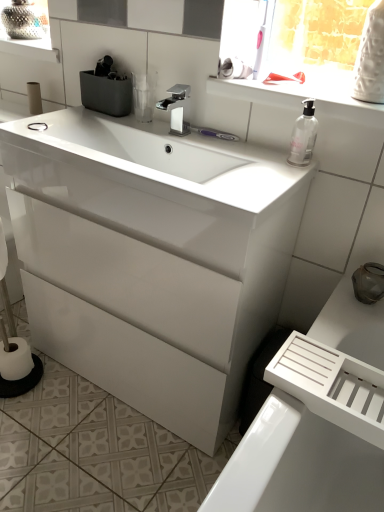
At what (x,y) coordinates should I click in order to perform the action: click on vacant space that is in between white glossy cabinet at center and white matte toilet paper at lower left, marked as the 3th toilet paper in a top-to-bottom arrangement. Please return your answer as a coordinate pair (x, y). The image size is (384, 512). Looking at the image, I should click on (93, 406).